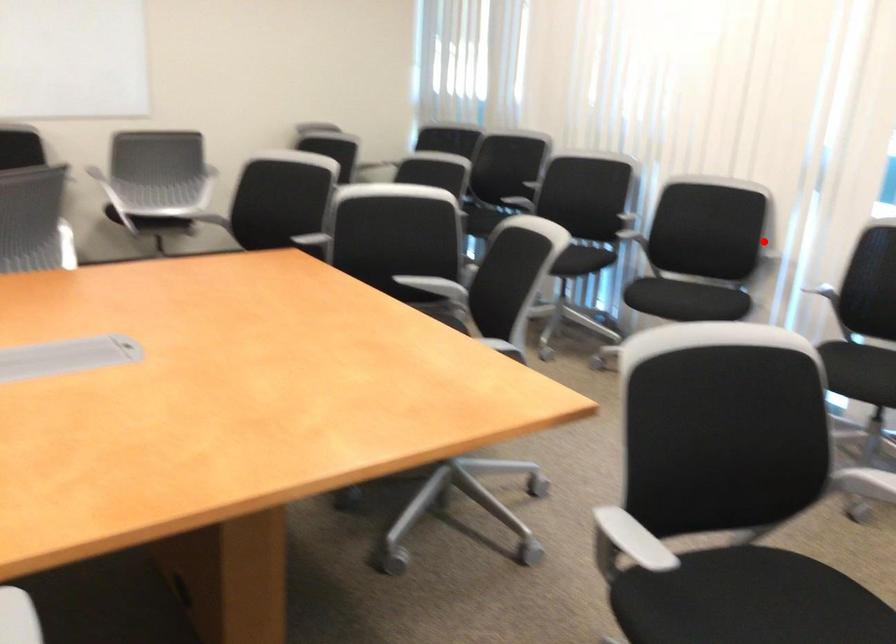
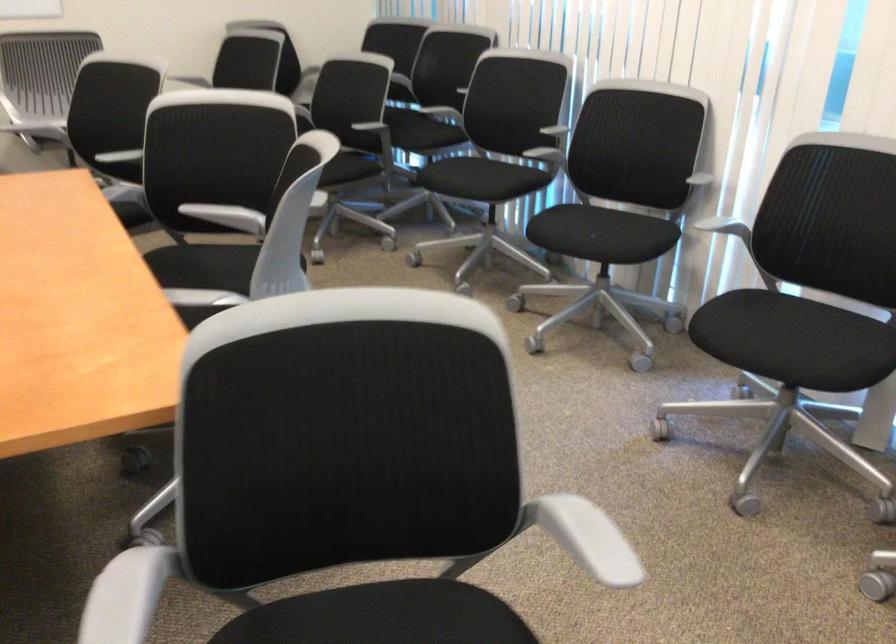
Question: I am providing you with two images of the same scene from different viewpoints. In image1, a red point is highlighted. Considering the same 3D point in image2, which of the following is correct?

Choices:
 (A) It is closer
 (B) It is farther

Answer: (A)